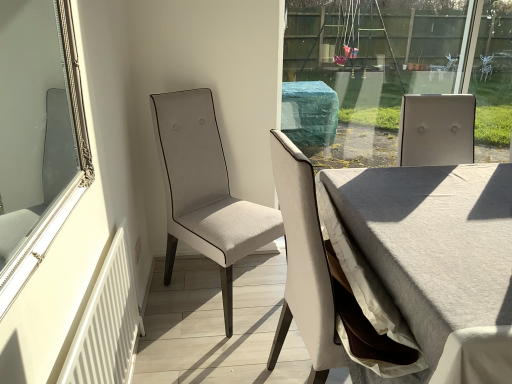
Measure the distance between white textured radiator at lower left and camera.

1.01 meters.

This screenshot has height=384, width=512. Identify the location of silver/golden mirror at left. (65, 189).

This screenshot has height=384, width=512. Describe the element at coordinates (205, 190) in the screenshot. I see `white fabric chair at center, the second chair from the front` at that location.

How much space does light beige fabric chair at center, which ranks as the 2th chair in back-to-front order, occupy vertically?

It is 1.04 meters.

This screenshot has height=384, width=512. What do you see at coordinates (322, 284) in the screenshot?
I see `light beige fabric chair at center, which ranks as the 2th chair in back-to-front order` at bounding box center [322, 284].

This screenshot has height=384, width=512. In order to click on white textured radiator at lower left in this screenshot , I will do `click(106, 325)`.

Is silver/golden mirror at left not inside white fabric chair at center, positioned as the first chair in back-to-front order?

Absolutely, silver/golden mirror at left is external to white fabric chair at center, positioned as the first chair in back-to-front order.

From the image's perspective, which one is positioned lower, silver/golden mirror at left or white fabric chair at center, positioned as the first chair in back-to-front order?

white fabric chair at center, positioned as the first chair in back-to-front order, is shown below in the image.

Considering the relative positions of silver/golden mirror at left and white fabric chair at center, positioned as the first chair in back-to-front order, in the image provided, is silver/golden mirror at left in front of white fabric chair at center, positioned as the first chair in back-to-front order,?

Yes, silver/golden mirror at left is in front of white fabric chair at center, positioned as the first chair in back-to-front order.

In the scene shown: Considering the relative sizes of silver/golden mirror at left and white fabric chair at center, the second chair from the front, in the image provided, is silver/golden mirror at left taller than white fabric chair at center, the second chair from the front,?

In fact, silver/golden mirror at left may be shorter than white fabric chair at center, the second chair from the front.

Which is closer, (182, 209) or (428, 177)?

Point (182, 209).

Considering the sizes of objects white fabric chair at center, the second chair from the front, and light gray fabric table at center in the image provided, who is shorter, white fabric chair at center, the second chair from the front, or light gray fabric table at center?

light gray fabric table at center.

Between white fabric chair at center, the second chair from the front, and light gray fabric table at center, which one appears on the right side from the viewer's perspective?

light gray fabric table at center.

From the image's perspective, which one is positioned higher, white fabric chair at center, positioned as the first chair in back-to-front order, or light gray fabric table at center?

white fabric chair at center, positioned as the first chair in back-to-front order, is shown above in the image.

Can light beige fabric chair at center, which ranks as the 2th chair in back-to-front order, be found inside light gray fabric table at center?

No.

Considering the positions of objects light gray fabric table at center and light beige fabric chair at center, which ranks as the 2th chair in back-to-front order, in the image provided, who is in front, light gray fabric table at center or light beige fabric chair at center, which ranks as the 2th chair in back-to-front order,?

light gray fabric table at center is closer to the camera.

Considering the relative positions of light gray fabric table at center and light beige fabric chair at center, which ranks as the 2th chair in back-to-front order, in the image provided, is light gray fabric table at center to the left of light beige fabric chair at center, which ranks as the 2th chair in back-to-front order, from the viewer's perspective?

No.

From the image's perspective, between light gray fabric table at center and light beige fabric chair at center, which appears as the 1th chair when viewed from the front, which one is located above?

light beige fabric chair at center, which appears as the 1th chair when viewed from the front, is shown above in the image.

Is white textured radiator at lower left wider or thinner than light gray fabric table at center?

Considering their sizes, white textured radiator at lower left looks slimmer than light gray fabric table at center.

Is white textured radiator at lower left positioned far away from light gray fabric table at center?

No, white textured radiator at lower left is not far from light gray fabric table at center.

Is white textured radiator at lower left turned away from light gray fabric table at center?

No, white textured radiator at lower left's orientation is not away from light gray fabric table at center.

How distant is white textured radiator at lower left from light gray fabric table at center?

white textured radiator at lower left is 36.62 inches away from light gray fabric table at center.

Does light beige fabric chair at center, which appears as the 1th chair when viewed from the front, have a smaller size compared to silver/golden mirror at left?

Actually, light beige fabric chair at center, which appears as the 1th chair when viewed from the front, might be larger than silver/golden mirror at left.

Is light beige fabric chair at center, which ranks as the 2th chair in back-to-front order, situated inside silver/golden mirror at left or outside?

light beige fabric chair at center, which ranks as the 2th chair in back-to-front order, is spatially situated outside silver/golden mirror at left.

Considering the sizes of objects light beige fabric chair at center, which ranks as the 2th chair in back-to-front order, and silver/golden mirror at left in the image provided, who is taller, light beige fabric chair at center, which ranks as the 2th chair in back-to-front order, or silver/golden mirror at left?

With more height is light beige fabric chair at center, which ranks as the 2th chair in back-to-front order.

From the image's perspective, which is below, light beige fabric chair at center, which ranks as the 2th chair in back-to-front order, or silver/golden mirror at left?

light beige fabric chair at center, which ranks as the 2th chair in back-to-front order.

From a real-world perspective, is light beige fabric chair at center, which appears as the 1th chair when viewed from the front, over white textured radiator at lower left?

Yes.

I want to click on radiator below the light beige fabric chair at center, which appears as the 1th chair when viewed from the front (from the image's perspective), so click(106, 325).

Who is smaller, light beige fabric chair at center, which appears as the 1th chair when viewed from the front, or white textured radiator at lower left?

white textured radiator at lower left is smaller.

Which of these two, white fabric chair at center, the second chair from the front, or white textured radiator at lower left, is thinner?

white textured radiator at lower left is thinner.

Who is smaller, white fabric chair at center, the second chair from the front, or white textured radiator at lower left?

Smaller between the two is white textured radiator at lower left.

Considering the relative positions of white fabric chair at center, the second chair from the front, and white textured radiator at lower left in the image provided, is white fabric chair at center, the second chair from the front, to the left or to the right of white textured radiator at lower left?

white fabric chair at center, the second chair from the front, is to the right of white textured radiator at lower left.

What are the coordinates of `window above the white fabric chair at center, positioned as the first chair in back-to-front order (from the image's perspective)` in the screenshot? It's located at (65, 189).

Identify the location of the 2nd chair counting from the left side of the light gray fabric table at center. [x=205, y=190].

Looking at the image, which one is located closer to white fabric chair at center, positioned as the first chair in back-to-front order, white textured radiator at lower left or light gray fabric table at center?

white textured radiator at lower left.

Estimate the real-world distances between objects in this image. Which object is closer to light beige fabric chair at center, which appears as the 1th chair when viewed from the front, light gray fabric table at center or silver/golden mirror at left?

Among the two, light gray fabric table at center is located nearer to light beige fabric chair at center, which appears as the 1th chair when viewed from the front.

Considering their positions, is white textured radiator at lower left positioned closer to silver/golden mirror at left than light beige fabric chair at center, which ranks as the 2th chair in back-to-front order?

Based on the image, white textured radiator at lower left appears to be nearer to silver/golden mirror at left.

Which object lies nearer to the anchor point white fabric chair at center, positioned as the first chair in back-to-front order, light gray fabric table at center or light beige fabric chair at center, which appears as the 1th chair when viewed from the front?

The object closer to white fabric chair at center, positioned as the first chair in back-to-front order, is light beige fabric chair at center, which appears as the 1th chair when viewed from the front.

Estimate the real-world distances between objects in this image. Which object is further from silver/golden mirror at left, light beige fabric chair at center, which ranks as the 2th chair in back-to-front order, or light gray fabric table at center?

light gray fabric table at center is positioned further to the anchor silver/golden mirror at left.

Based on their spatial positions, is light beige fabric chair at center, which appears as the 1th chair when viewed from the front, or light gray fabric table at center closer to white fabric chair at center, the second chair from the front?

The object closer to white fabric chair at center, the second chair from the front, is light beige fabric chair at center, which appears as the 1th chair when viewed from the front.

Considering their positions, is silver/golden mirror at left positioned further to white textured radiator at lower left than light gray fabric table at center?

light gray fabric table at center is further to white textured radiator at lower left.

Considering their positions, is white fabric chair at center, the second chair from the front, positioned closer to silver/golden mirror at left than white textured radiator at lower left?

white textured radiator at lower left is positioned closer to the anchor silver/golden mirror at left.

Locate an element on the screen. The height and width of the screenshot is (384, 512). chair between silver/golden mirror at left and white fabric chair at center, positioned as the first chair in back-to-front order, along the z-axis is located at coordinates (322, 284).

You are a GUI agent. You are given a task and a screenshot of the screen. Output one action in this format:
    pyautogui.click(x=<x>, y=<y>)
    Task: Click on the window located between white textured radiator at lower left and light beige fabric chair at center, which appears as the 1th chair when viewed from the front, in the left-right direction
    
    Given the screenshot: What is the action you would take?
    pyautogui.click(x=65, y=189)

You are a GUI agent. You are given a task and a screenshot of the screen. Output one action in this format:
    pyautogui.click(x=<x>, y=<y>)
    Task: Click on the chair between white fabric chair at center, the second chair from the front, and light gray fabric table at center
    The width and height of the screenshot is (512, 384).
    Given the screenshot: What is the action you would take?
    pyautogui.click(x=322, y=284)

Find the location of a particular element. chair between white textured radiator at lower left and white fabric chair at center, positioned as the first chair in back-to-front order, in the front-back direction is located at coordinates tap(322, 284).